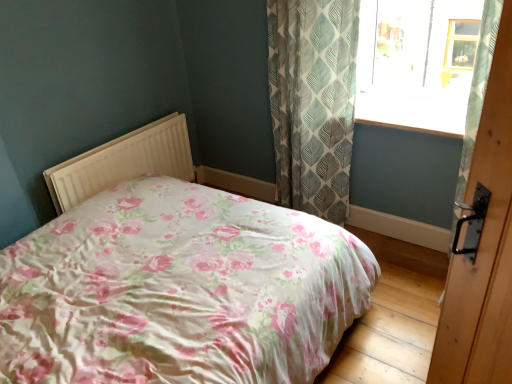
Question: From a real-world perspective, relative to white plastic radiator at center, is green leaf-patterned fabric curtain at upper right vertically above or below?

Choices:
 (A) above
 (B) below

Answer: (A)

Question: Is green leaf-patterned fabric curtain at upper right wider or thinner than white plastic radiator at center?

Choices:
 (A) thin
 (B) wide

Answer: (B)

Question: Which is nearer to the white plastic radiator at center?

Choices:
 (A) wooden door handle at right
 (B) green leaf-patterned fabric curtain at upper right
 (C) transparent glass window at upper right
 (D) floral fabric bed at center

Answer: (D)

Question: Which is farther from the green leaf-patterned fabric curtain at upper right?

Choices:
 (A) wooden door handle at right
 (B) floral fabric bed at center
 (C) transparent glass window at upper right
 (D) white plastic radiator at center

Answer: (A)